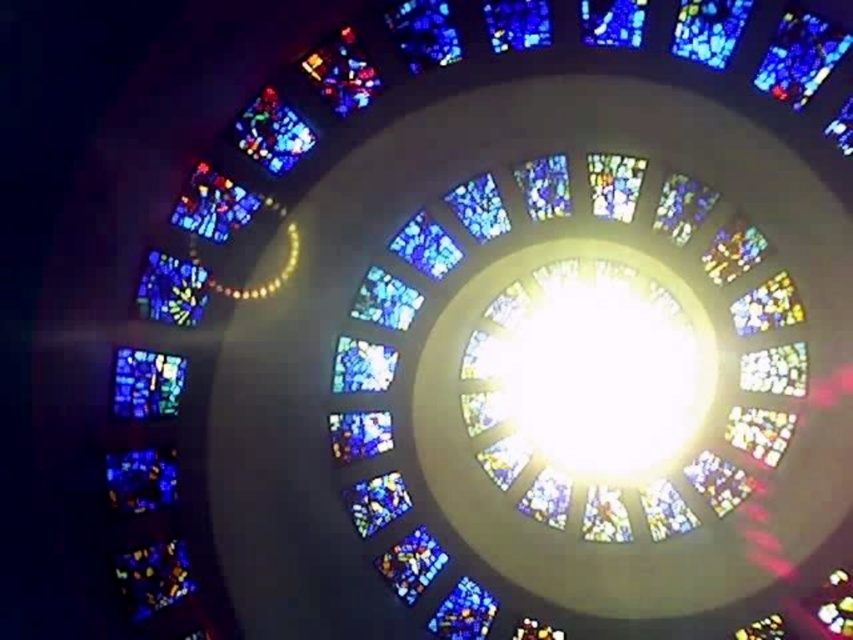
You are an art restorer examining the stained glass window. You need to replace a damaged piece. Which piece, the multicolored stained glass at lower left or the multicolored stained glass window at upper left, requires a larger replacement piece?

The multicolored stained glass at lower left requires a larger replacement piece because it has a larger size compared to the multicolored stained glass window at upper left.

You are standing in front of the circular stained glass window and notice two sections of multicolored stained glass at lower left and multicolored stained glass window at upper left. Which section would appear larger to you?

The multicolored stained glass at lower left is closer to the viewer than the multicolored stained glass window at upper left, so it would appear larger.

You are standing 100 feet away from the point at coordinates point (514, 428). If you walk directly towards it, how many more feet will you need to walk to reach the point?

You are currently 100 feet away from the point (514, 428), and the total distance to the point is 396.15 feet. Therefore, you need to walk an additional 296.15 feet to reach the point.